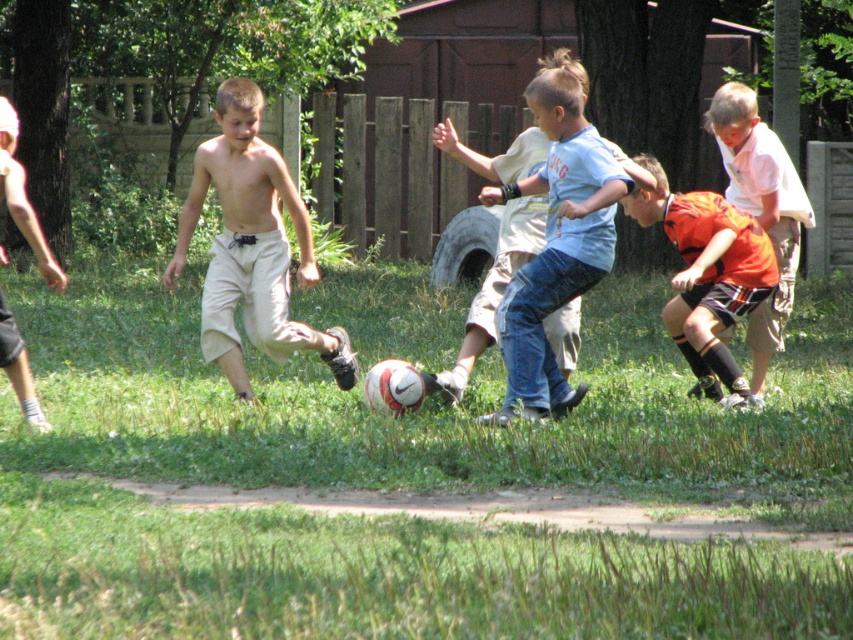
You are a photographer trying to capture a photo of both the blue denim jeans at center and the orange striped shorts at center. Since you want them both in focus, you need to know their positions relative to each other. Which one is positioned to the left?

The blue denim jeans at center are to the left of the orange striped shorts at center.